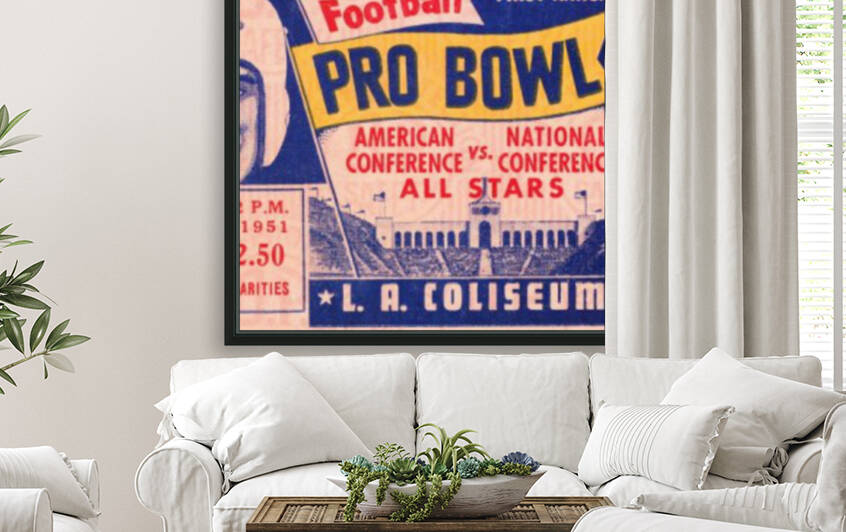
You are a GUI agent. You are given a task and a screenshot of the screen. Output one action in this format:
    pyautogui.click(x=<x>, y=<y>)
    Task: Click on the chair
    The width and height of the screenshot is (846, 532).
    Given the screenshot: What is the action you would take?
    pyautogui.click(x=58, y=515), pyautogui.click(x=731, y=519)